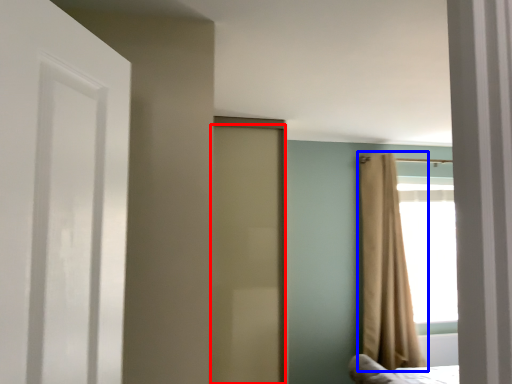
Question: Which of the following is the farthest to the observer, door (highlighted by a red box) or curtain (highlighted by a blue box)?

Choices:
 (A) door
 (B) curtain

Answer: (B)